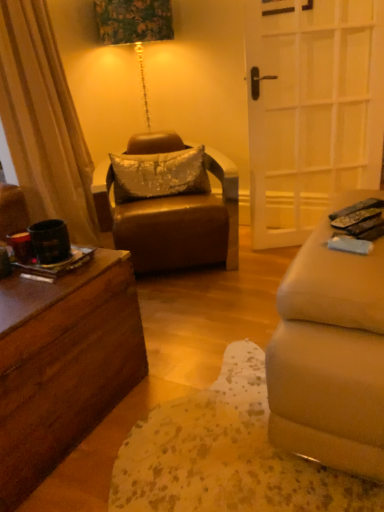
Question: Is point (231, 265) positioned closer to the camera than point (324, 53)?

Choices:
 (A) farther
 (B) closer

Answer: (B)

Question: From the image's perspective, is leather at center above or below white glass door at right?

Choices:
 (A) above
 (B) below

Answer: (B)

Question: Estimate the real-world distances between objects in this image. Which object is farther from the leather at center?

Choices:
 (A) silver sequined pillow at center
 (B) white glass door at right
 (C) black plastic remote control at lower right

Answer: (C)

Question: Which object is the farthest from the white glass door at right?

Choices:
 (A) black plastic remote control at lower right
 (B) silver sequined pillow at center
 (C) leather at center

Answer: (A)